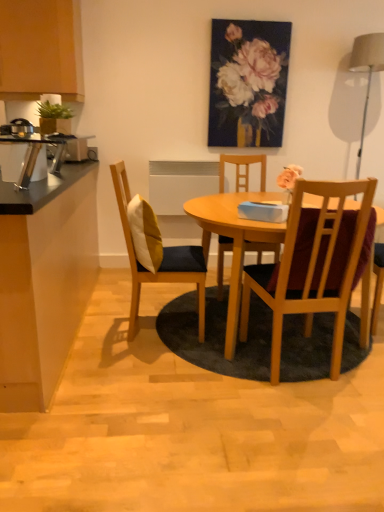
Identify the location of free spot to the left of wooden chair with cushion at center, the 3th chair from the right. (100, 324).